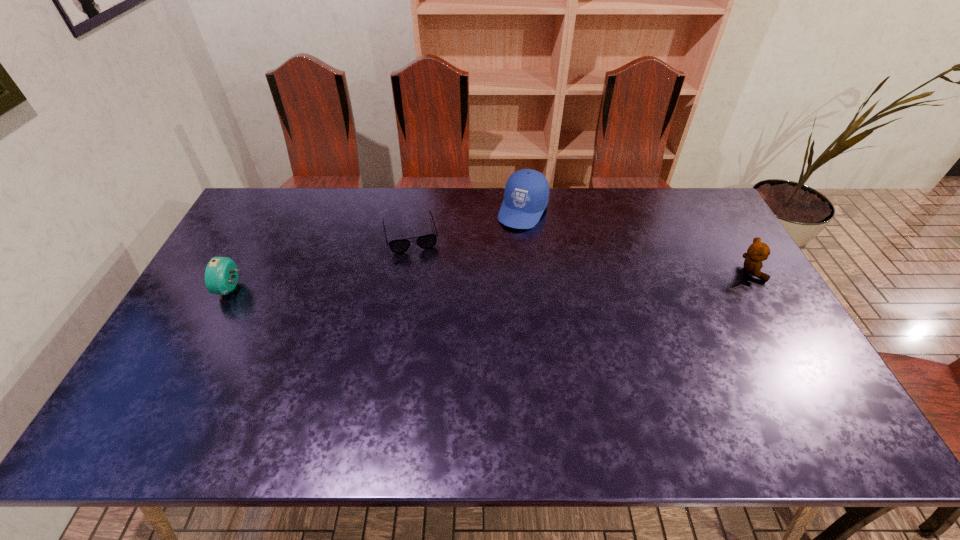
Where is `vacant spot on the desktop that is between the alarm clock and the teddy bear and is positioned on the front-facing side of the third object from left to right`? The width and height of the screenshot is (960, 540). vacant spot on the desktop that is between the alarm clock and the teddy bear and is positioned on the front-facing side of the third object from left to right is located at coordinates (484, 280).

The width and height of the screenshot is (960, 540). I want to click on free space on the desktop that is between the leftmost object and the teddy bear and is positioned on the front-facing side of the second object from left to right, so click(421, 282).